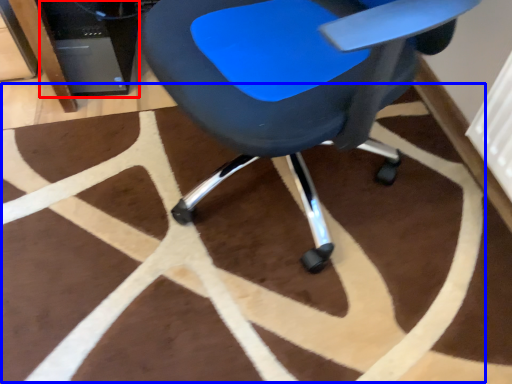
Question: Which object is closer to the camera taking this photo, computer tower (highlighted by a red box) or mat (highlighted by a blue box)?

Choices:
 (A) computer tower
 (B) mat

Answer: (B)